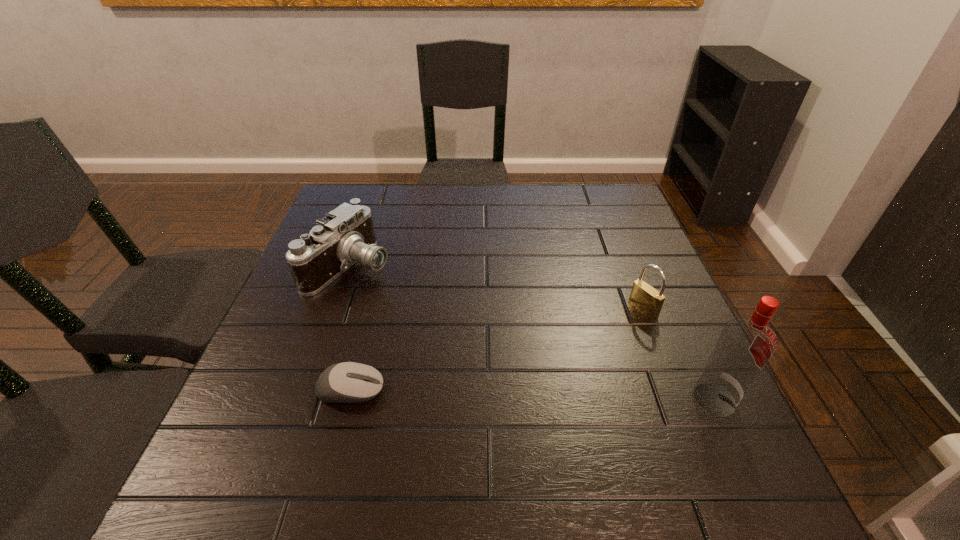
Where is `the shortest object`? the shortest object is located at coordinates (349, 382).

Image resolution: width=960 pixels, height=540 pixels. Find the location of `vodka`. vodka is located at coordinates (746, 344).

At what (x,y) coordinates should I click in order to perform the action: click on the rightmost object. Please return your answer as a coordinate pair (x, y). Image resolution: width=960 pixels, height=540 pixels. Looking at the image, I should click on (746, 344).

I want to click on the farthest object, so click(x=346, y=235).

Locate an element on the screen. The image size is (960, 540). the second farthest object is located at coordinates (646, 299).

You are a GUI agent. You are given a task and a screenshot of the screen. Output one action in this format:
    pyautogui.click(x=<x>, y=<y>)
    Task: Click on the third object from left to right
    This screenshot has height=540, width=960.
    Given the screenshot: What is the action you would take?
    pyautogui.click(x=646, y=299)

I want to click on blank area located 0.330m on the wheel side of the computer equipment, so click(x=556, y=390).

The height and width of the screenshot is (540, 960). I want to click on vacant region located 0.370m at the lens of the camera, so click(501, 359).

Where is `free space located at the lens of the camera`? This screenshot has width=960, height=540. free space located at the lens of the camera is located at coordinates (436, 319).

Identify the location of vacant space located at the lens of the camera. (420, 309).